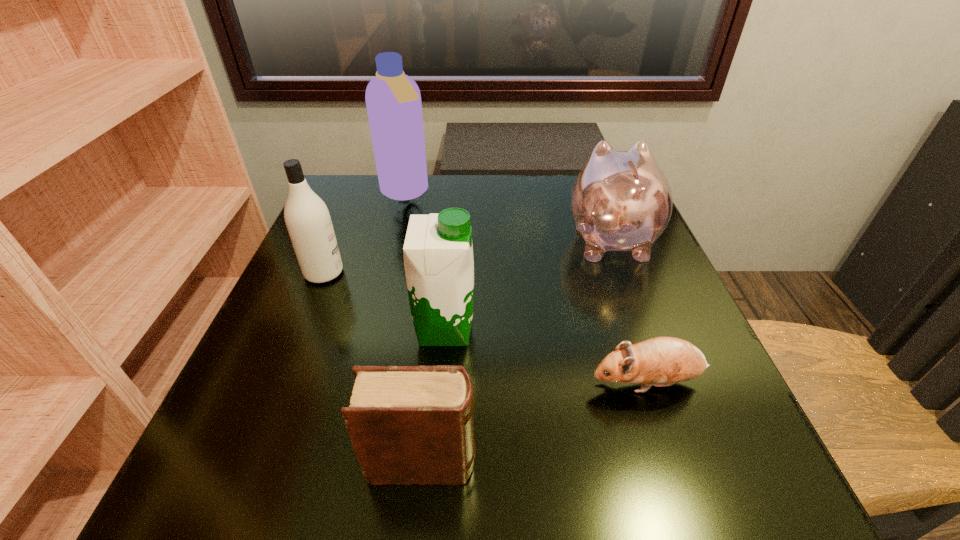
This screenshot has width=960, height=540. In the image, there is a desktop. Identify the location of vacant space at the far left corner. (358, 204).

This screenshot has width=960, height=540. What are the coordinates of `free region at the near left corner of the desktop` in the screenshot? It's located at [x=300, y=502].

Where is `free space at the far right corner of the desktop`? The width and height of the screenshot is (960, 540). free space at the far right corner of the desktop is located at coordinates (573, 174).

Where is `vacant area between the diary and the hamster`? The height and width of the screenshot is (540, 960). vacant area between the diary and the hamster is located at coordinates (535, 423).

This screenshot has height=540, width=960. In order to click on free spot between the hamster and the farther shampoo in this screenshot , I will do `click(526, 288)`.

This screenshot has width=960, height=540. Find the location of `vacant space that is in between the shortest object and the nearer shampoo`. vacant space that is in between the shortest object and the nearer shampoo is located at coordinates (486, 328).

Where is `empty location between the shorter shampoo and the shortest object`? This screenshot has height=540, width=960. empty location between the shorter shampoo and the shortest object is located at coordinates (486, 328).

This screenshot has height=540, width=960. In order to click on vacant space that's between the farthest object and the fifth farthest object in this screenshot , I will do click(526, 288).

Where is `vacant point located between the hamster and the shorter shampoo`? vacant point located between the hamster and the shorter shampoo is located at coordinates (486, 328).

Where is `free space that is in between the farthest object and the piggy bank`? free space that is in between the farthest object and the piggy bank is located at coordinates (508, 216).